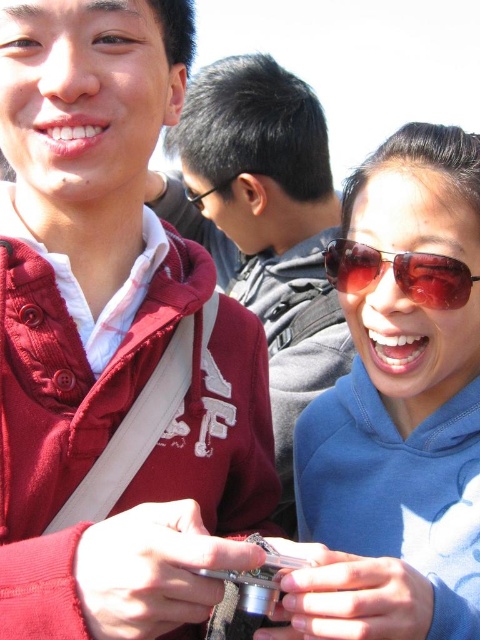
Consider the image. You are a photographer trying to capture the perfect shot. You notice the matte blue hoodie at center and the shiny brown sunglasses at lower right. Which object should you focus on to ensure it appears larger in your photo?

The shiny brown sunglasses at lower right should be focused on to appear larger because they are positioned higher up, closer to the camera compared to the matte blue hoodie at center which is lower and farther away.

You are a photographer trying to fit both the matte blue hoodie at center and the matte red hoodie at center into a frame. Which hoodie has a wider width to ensure proper framing?

The matte blue hoodie at center has a wider width than the matte red hoodie at center, so it requires more space in the frame.

You are standing in the scene and want to take a photo of both the matte red jacket at left and the matte blue hoodie at center. Which one should you focus on first to ensure both are in frame?

You should focus on the matte blue hoodie at center first because it is closer to the center of the scene, making it easier to frame both objects within the camera view.